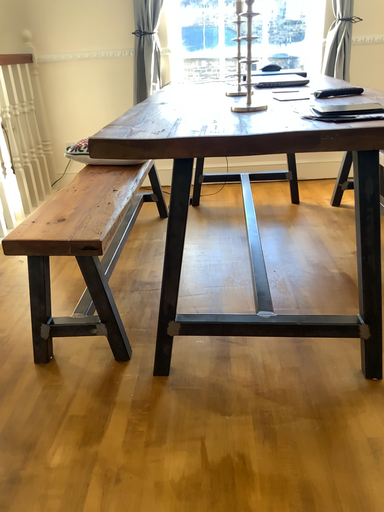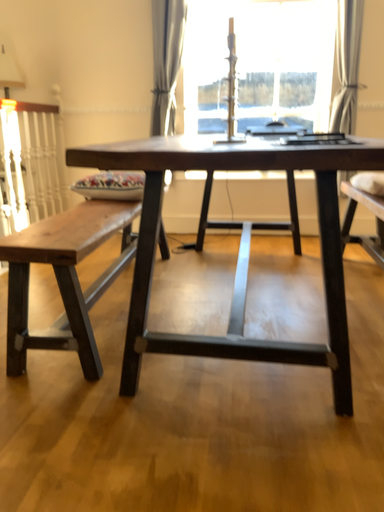
Question: How did the camera likely rotate when shooting the video?

Choices:
 (A) rotated downward
 (B) rotated upward

Answer: (B)